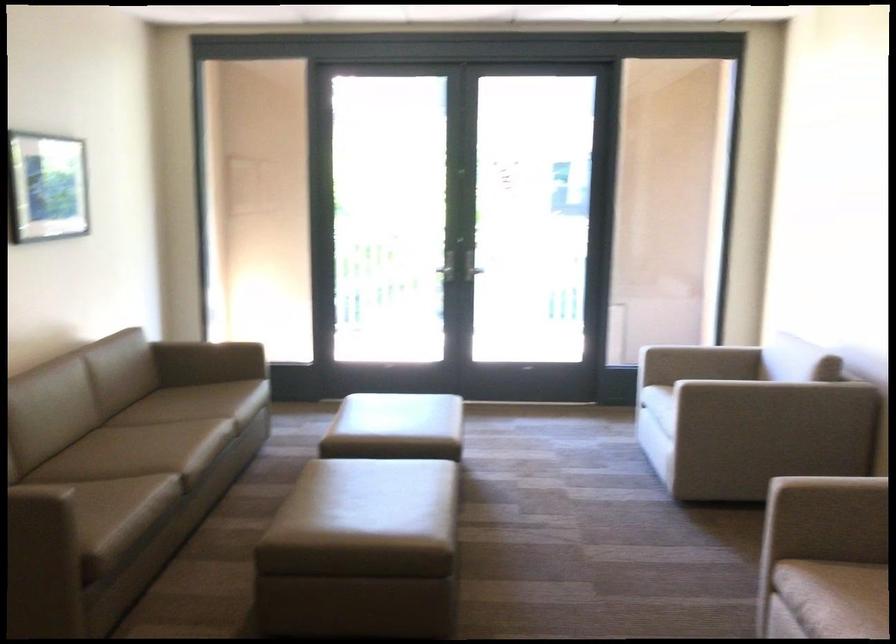
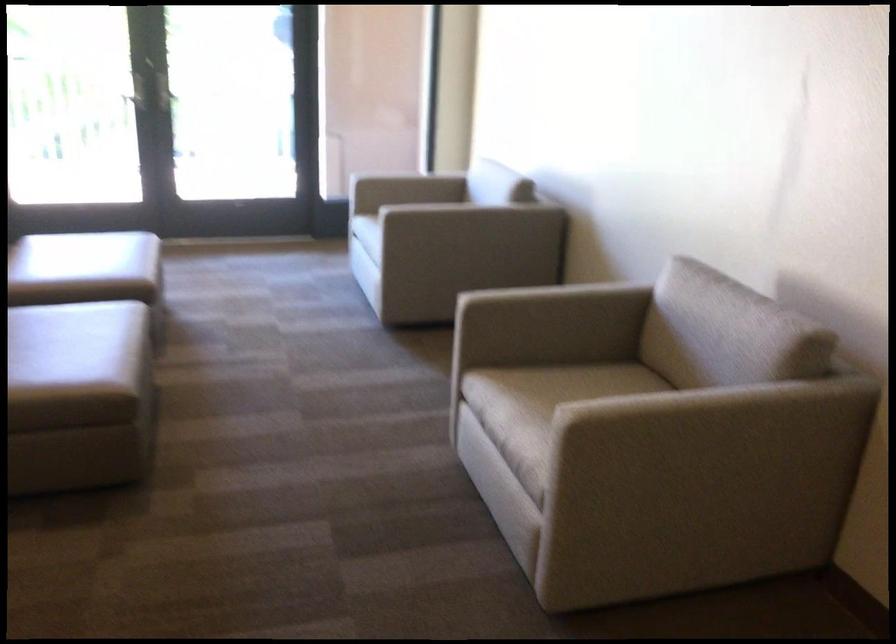
What movement of the cameraman would produce the second image?

The movement direction of the cameraman is right, forward.